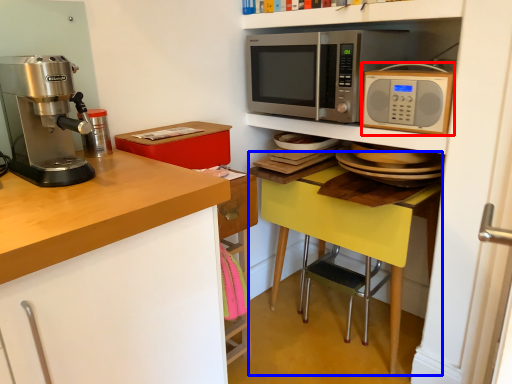
Question: Which of the following is the farthest to the observer, microwave oven (highlighted by a red box) or table (highlighted by a blue box)?

Choices:
 (A) microwave oven
 (B) table

Answer: (B)